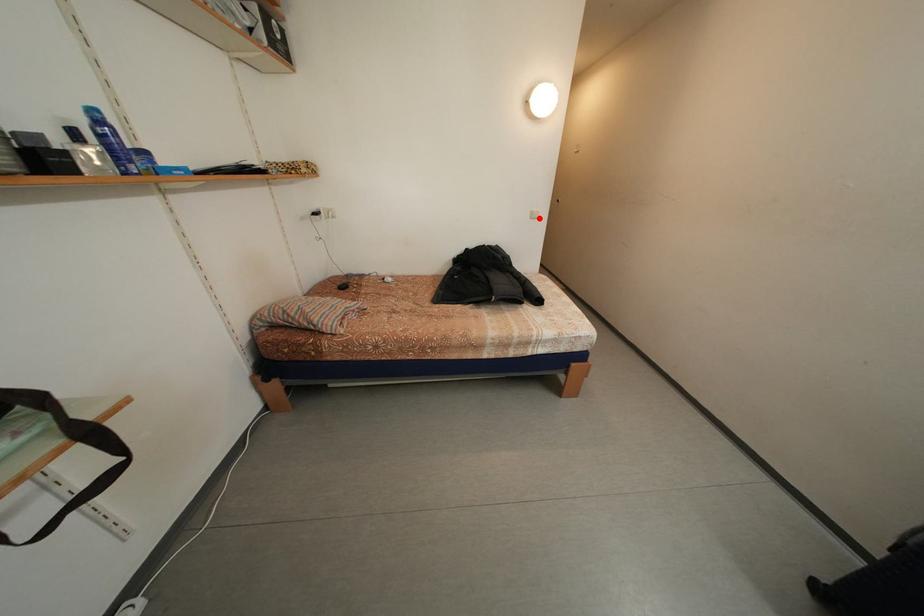
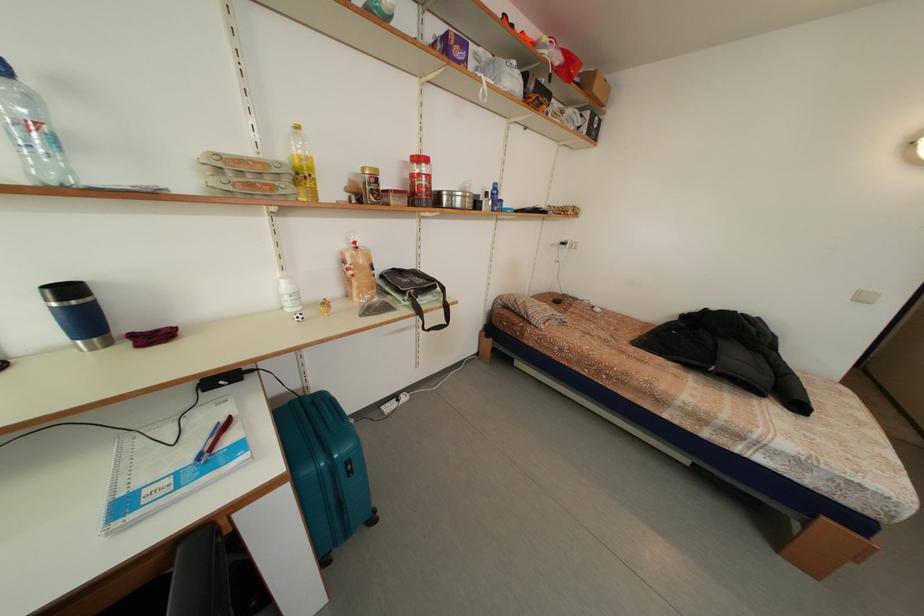
Locate, in the second image, the point that corresponds to the highlighted location in the first image.

(868, 298)